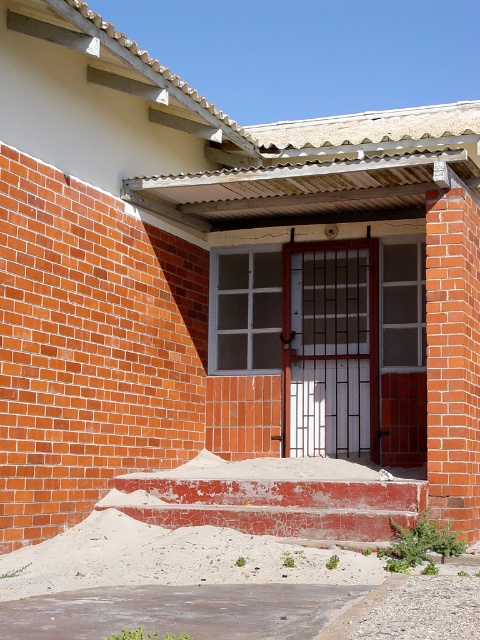
Can you confirm if white matte door at center is wider than red brick wall at right?

Yes.

Is point (288, 360) in front of point (479, 353)?

That is False.

Who is more forward, [365,440] or [467,531]?

Point [467,531] is in front.

The image size is (480, 640). I want to click on white matte door at center, so click(x=330, y=349).